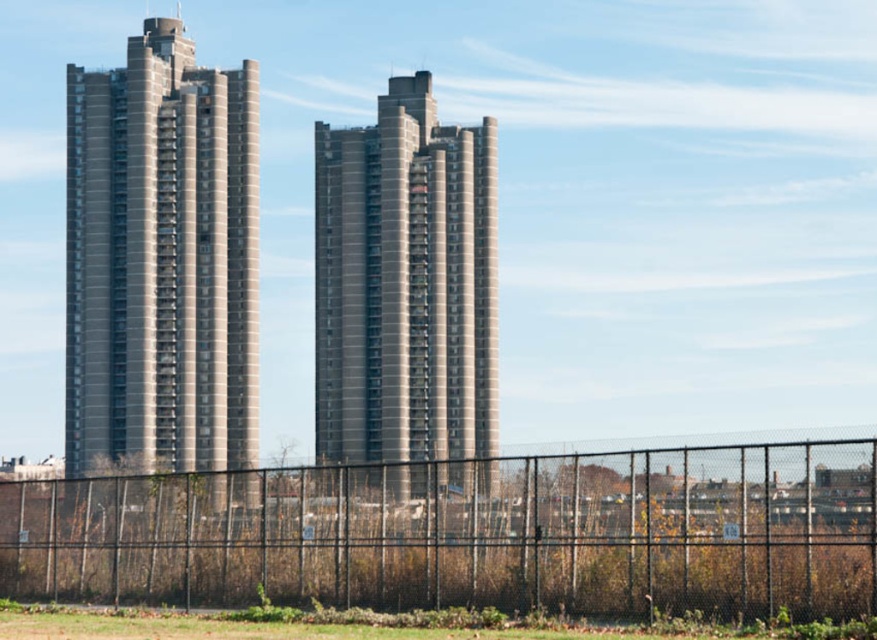
Is gray concrete building at left further to camera compared to gray concrete building at center?

Yes, gray concrete building at left is behind gray concrete building at center.

Measure the distance between gray concrete building at left and gray concrete building at center.

50.68 feet

The image size is (877, 640). Identify the location of gray concrete building at left. (161, 260).

Can you confirm if black metal fence at lower center is smaller than gray concrete building at center?

Yes, black metal fence at lower center is smaller than gray concrete building at center.

From the picture: Can you confirm if black metal fence at lower center is positioned to the left of gray concrete building at center?

Incorrect, black metal fence at lower center is not on the left side of gray concrete building at center.

Is point (176, 508) closer to camera compared to point (458, 332)?

Yes.

Where is `black metal fence at lower center`? Image resolution: width=877 pixels, height=640 pixels. black metal fence at lower center is located at coordinates (467, 532).

How far apart are black metal fence at lower center and gray concrete building at left?

The distance of black metal fence at lower center from gray concrete building at left is 106.42 meters.

Describe the element at coordinates (467, 532) in the screenshot. I see `black metal fence at lower center` at that location.

This screenshot has height=640, width=877. I want to click on black metal fence at lower center, so click(x=467, y=532).

Where is `black metal fence at lower center`? This screenshot has width=877, height=640. black metal fence at lower center is located at coordinates (467, 532).